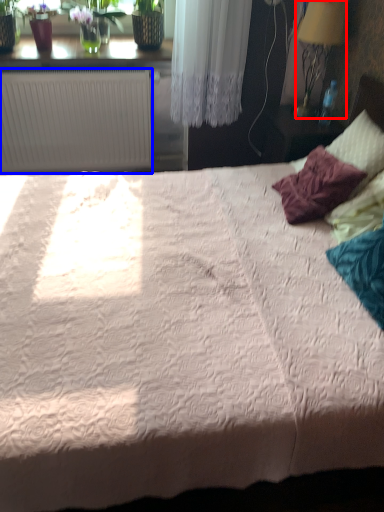
Question: Among these objects, which one is farthest to the camera, lamp (highlighted by a red box) or radiator (highlighted by a blue box)?

Choices:
 (A) lamp
 (B) radiator

Answer: (B)